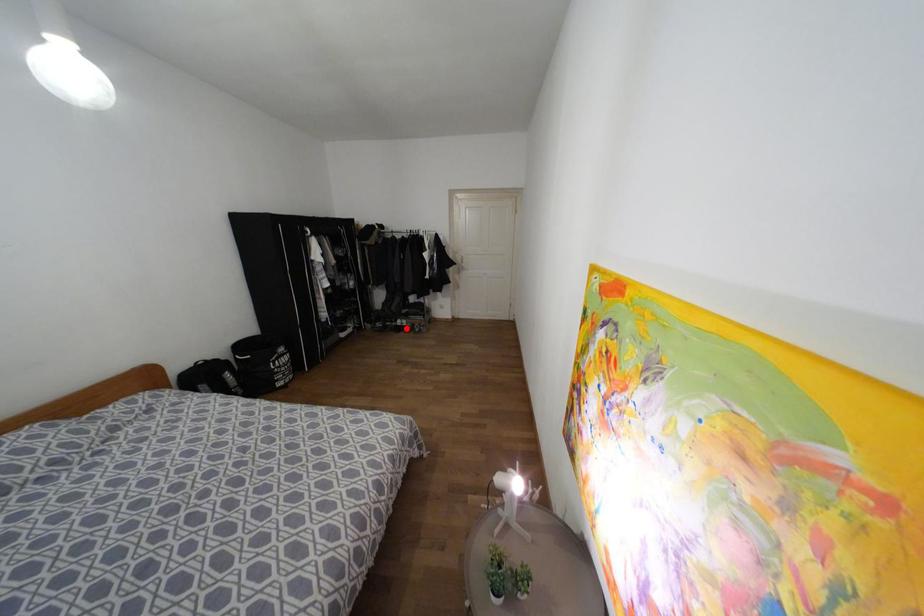
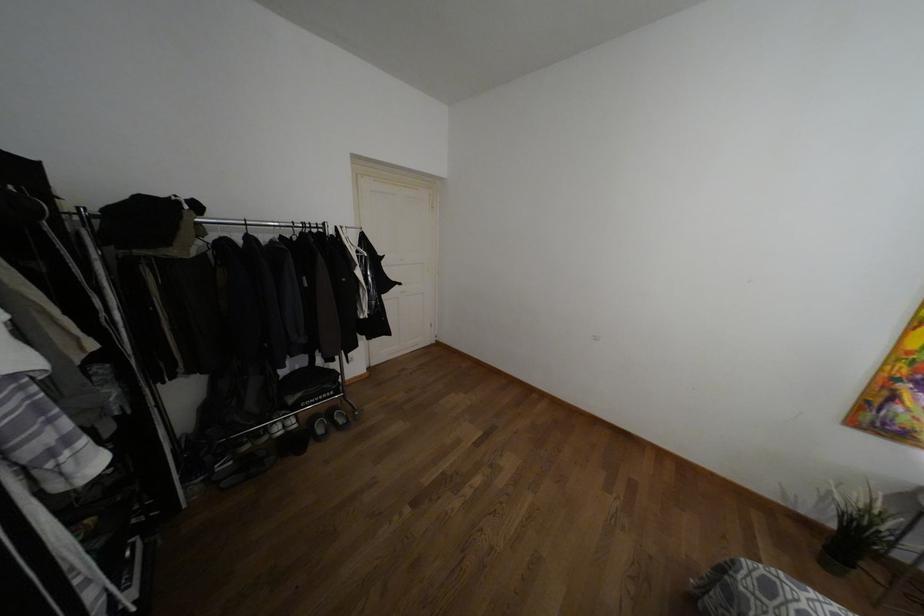
Question: I am providing you with two images of the same scene from different viewpoints. Image1 has a red point marked. In image2, the corresponding 3D location appears at what relative position? Reply with the corresponding letter.

Choices:
 (A) Closer
 (B) Farther

Answer: (A)